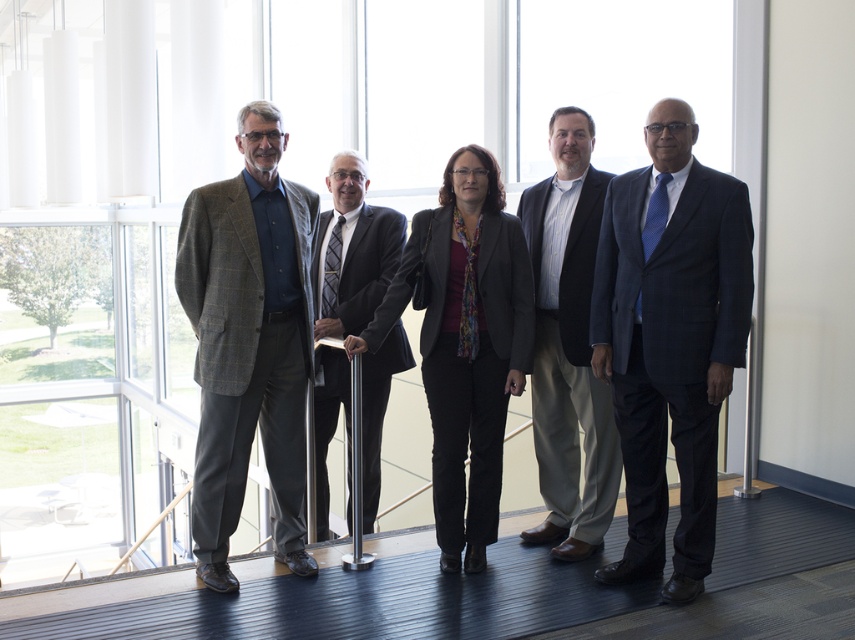
You are standing on the staircase with a glass railing and want to reach the point closer to you. Which point should you head towards, point (621, 372) or point (494, 292)?

Point (621, 372) is closer to the viewer than point (494, 292), so you should head towards point (621, 372).

You are a photographer taking a group photo of the people on the staircase. You want to ensure that the dark blue pinstripe suit at right and the matte black blazer at center are both in the frame. Based on their positions, which direction should you move the camera to include both individuals?

The dark blue pinstripe suit at right is to the right of the matte black blazer at center. To include both in the frame, move the camera slightly to the right so that it captures the area from the matte black blazer at center to the dark blue pinstripe suit at right.

You are standing at the base of the staircase and want to reach the top. There are two points marked on the staircase, point A at coordinates point(x=576, y=166) and point B at coordinates point(x=517, y=321). Which point is closer to the top of the staircase?

Point A at coordinates point(x=576, y=166) is behind point B at coordinates point(x=517, y=321), so point A is closer to the top of the staircase.